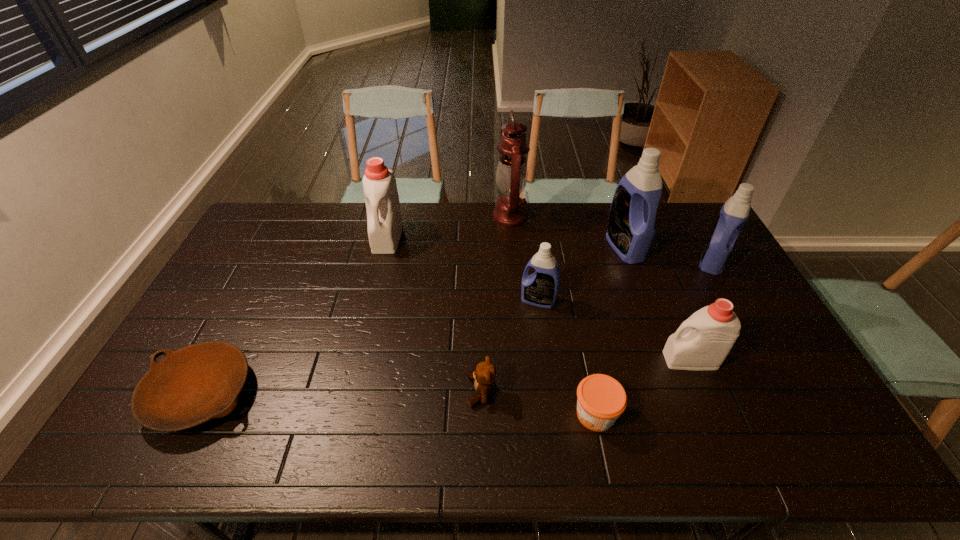
What are the coordinates of `red oil lamp` in the screenshot? It's located at (511, 174).

Locate an element on the screen. The width and height of the screenshot is (960, 540). the tallest detergent is located at coordinates (630, 232).

Image resolution: width=960 pixels, height=540 pixels. Identify the location of the second blue detergent from right to left. (630, 232).

Locate an element on the screen. The image size is (960, 540). the bigger white detergent is located at coordinates (384, 221).

Where is `the farther white detergent`? The width and height of the screenshot is (960, 540). the farther white detergent is located at coordinates [384, 221].

Where is `the rightmost object`? This screenshot has height=540, width=960. the rightmost object is located at coordinates (734, 213).

I want to click on the second smallest blue detergent, so click(734, 213).

Find the location of a particular element. The height and width of the screenshot is (540, 960). the leftmost blue detergent is located at coordinates (541, 288).

Locate an element on the screen. the fourth detergent from right to left is located at coordinates (541, 288).

This screenshot has width=960, height=540. What are the coordinates of `the nearer white detergent` in the screenshot? It's located at (702, 342).